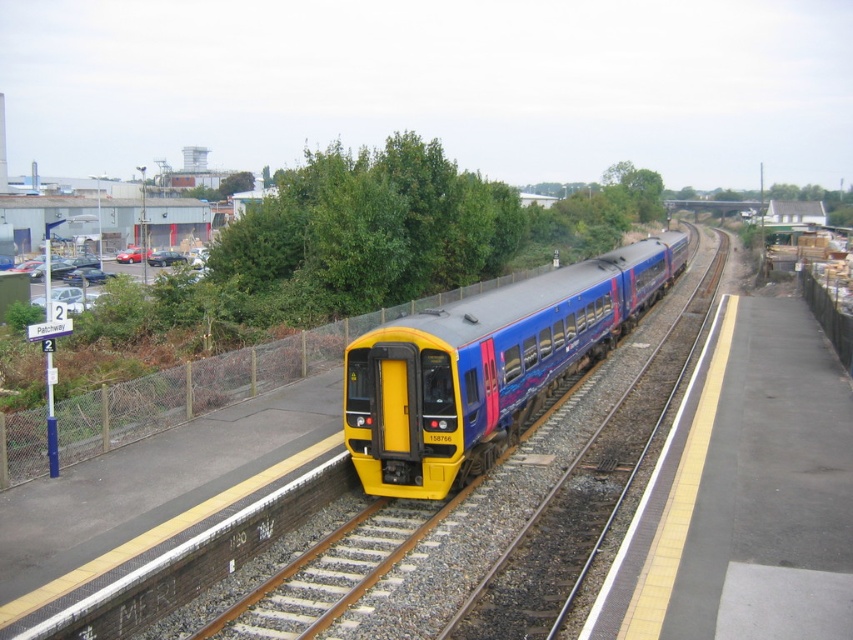
Does point (368, 449) lie behind point (643, 182)?

No.

Between matte blue train at center and green leafy tree at upper center, which one appears on the right side from the viewer's perspective?

From the viewer's perspective, green leafy tree at upper center appears more on the right side.

Who is more distant from viewer, [389,328] or [659,216]?

Positioned behind is point [659,216].

Identify the location of matte blue train at center. [486, 365].